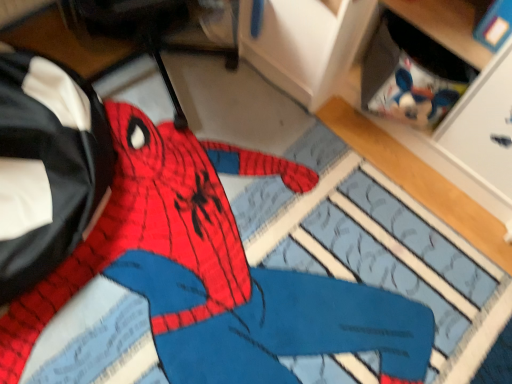
Question: Does black leather messenger bag at left have a greater width compared to knitted fabric spiderman at center?

Choices:
 (A) no
 (B) yes

Answer: (A)

Question: Is black leather messenger bag at left thinner than knitted fabric spiderman at center?

Choices:
 (A) yes
 (B) no

Answer: (A)

Question: Is black leather messenger bag at left not inside knitted fabric spiderman at center?

Choices:
 (A) no
 (B) yes

Answer: (B)

Question: From a real-world perspective, is black leather messenger bag at left on top of knitted fabric spiderman at center?

Choices:
 (A) no
 (B) yes

Answer: (B)

Question: Is black leather messenger bag at left in contact with knitted fabric spiderman at center?

Choices:
 (A) no
 (B) yes

Answer: (A)

Question: From a real-world perspective, is black leather messenger bag at left located beneath knitted fabric spiderman at center?

Choices:
 (A) yes
 (B) no

Answer: (B)

Question: From a real-world perspective, is knitted fabric spiderman at center below black leather messenger bag at left?

Choices:
 (A) yes
 (B) no

Answer: (A)

Question: From the image's perspective, is knitted fabric spiderman at center under black leather messenger bag at left?

Choices:
 (A) no
 (B) yes

Answer: (B)

Question: Is knitted fabric spiderman at center next to black leather messenger bag at left?

Choices:
 (A) yes
 (B) no

Answer: (B)

Question: Is knitted fabric spiderman at center positioned before black leather messenger bag at left?

Choices:
 (A) yes
 (B) no

Answer: (A)

Question: Is black leather messenger bag at left at the back of knitted fabric spiderman at center?

Choices:
 (A) yes
 (B) no

Answer: (B)

Question: Does knitted fabric spiderman at center have a larger size compared to black leather messenger bag at left?

Choices:
 (A) no
 (B) yes

Answer: (A)

Question: Looking at their shapes, would you say knitted fabric spiderman at center is wider or thinner than black leather messenger bag at left?

Choices:
 (A) wide
 (B) thin

Answer: (A)